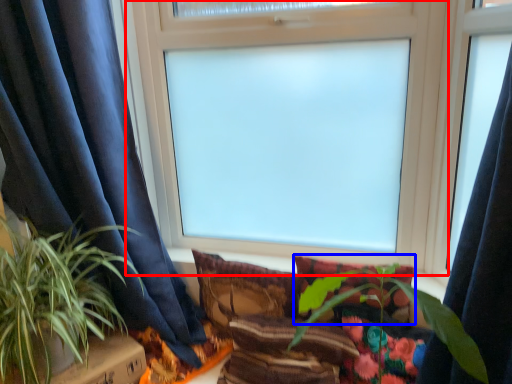
Question: Which object is closer to the camera taking this photo, window (highlighted by a red box) or pillow (highlighted by a blue box)?

Choices:
 (A) window
 (B) pillow

Answer: (A)